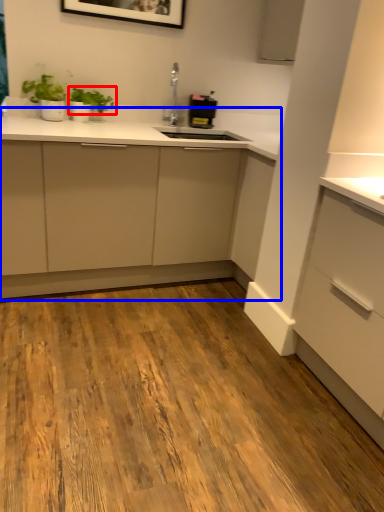
Question: Which point is further to the camera, plant (highlighted by a red box) or cabinetry (highlighted by a blue box)?

Choices:
 (A) plant
 (B) cabinetry

Answer: (A)